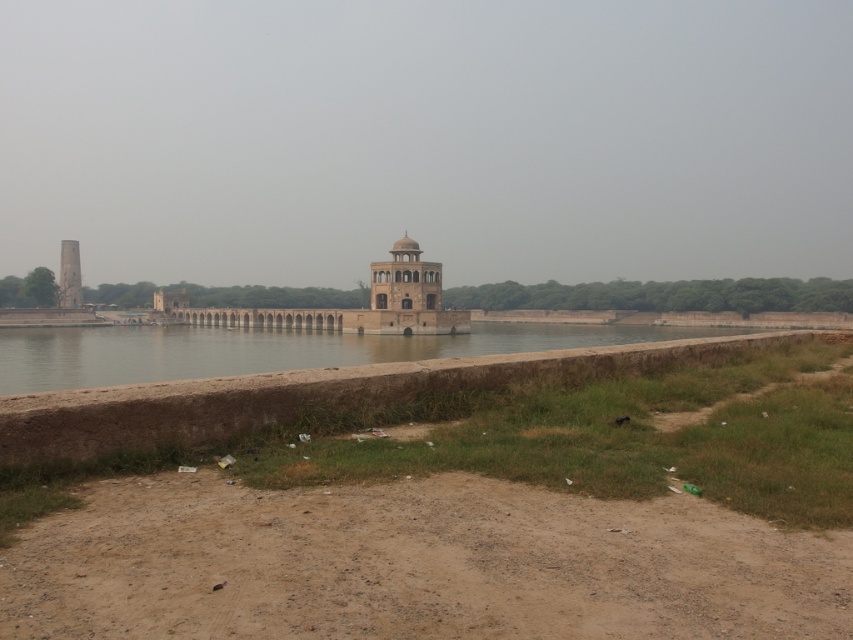
Looking at this image, measure the distance from smooth stone palace at center to smooth white tower at left.

smooth stone palace at center is 45.57 meters from smooth white tower at left.

Does smooth stone palace at center have a lesser height compared to smooth white tower at left?

Yes, smooth stone palace at center is shorter than smooth white tower at left.

At what (x,y) coordinates should I click in order to perform the action: click on smooth stone palace at center. Please return your answer as a coordinate pair (x, y). This screenshot has height=640, width=853. Looking at the image, I should click on (349, 308).

Locate an element on the screen. The image size is (853, 640). smooth stone palace at center is located at coordinates (349, 308).